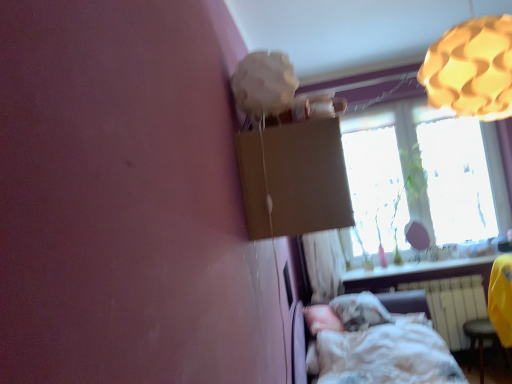
Question: Is translucent glass window at upper right to the right of white matte radiator at lower right from the viewer's perspective?

Choices:
 (A) no
 (B) yes

Answer: (A)

Question: Is translucent glass window at upper right positioned with its back to white matte radiator at lower right?

Choices:
 (A) yes
 (B) no

Answer: (B)

Question: Considering the relative sizes of translucent glass window at upper right and white matte radiator at lower right in the image provided, is translucent glass window at upper right taller than white matte radiator at lower right?

Choices:
 (A) yes
 (B) no

Answer: (A)

Question: From the image's perspective, is translucent glass window at upper right on top of white matte radiator at lower right?

Choices:
 (A) no
 (B) yes

Answer: (B)

Question: Is translucent glass window at upper right further to the viewer compared to white matte radiator at lower right?

Choices:
 (A) no
 (B) yes

Answer: (B)

Question: From the image's perspective, is white matte radiator at lower right above or below smooth white window sill at lower right?

Choices:
 (A) above
 (B) below

Answer: (B)

Question: In terms of size, does white matte radiator at lower right appear bigger or smaller than smooth white window sill at lower right?

Choices:
 (A) big
 (B) small

Answer: (A)

Question: Would you say white matte radiator at lower right is to the left or to the right of smooth white window sill at lower right in the picture?

Choices:
 (A) right
 (B) left

Answer: (A)

Question: From a real-world perspective, is white matte radiator at lower right above or below smooth white window sill at lower right?

Choices:
 (A) below
 (B) above

Answer: (A)

Question: From a real-world perspective, is brown cardboard box at upper center physically located above or below smooth white window sill at lower right?

Choices:
 (A) above
 (B) below

Answer: (A)

Question: Is brown cardboard box at upper center spatially inside smooth white window sill at lower right, or outside of it?

Choices:
 (A) outside
 (B) inside

Answer: (A)

Question: Considering their positions, is brown cardboard box at upper center located in front of or behind smooth white window sill at lower right?

Choices:
 (A) front
 (B) behind

Answer: (A)

Question: Is brown cardboard box at upper center to the left or to the right of smooth white window sill at lower right in the image?

Choices:
 (A) right
 (B) left

Answer: (B)

Question: From a real-world perspective, is white paper lampshade at upper center, placed as the 1th lamp when sorted from left to right, positioned above or below white matte radiator at lower right?

Choices:
 (A) above
 (B) below

Answer: (A)

Question: Visually, is white paper lampshade at upper center, which ranks as the 2th lamp in right-to-left order, positioned to the left or to the right of white matte radiator at lower right?

Choices:
 (A) left
 (B) right

Answer: (A)